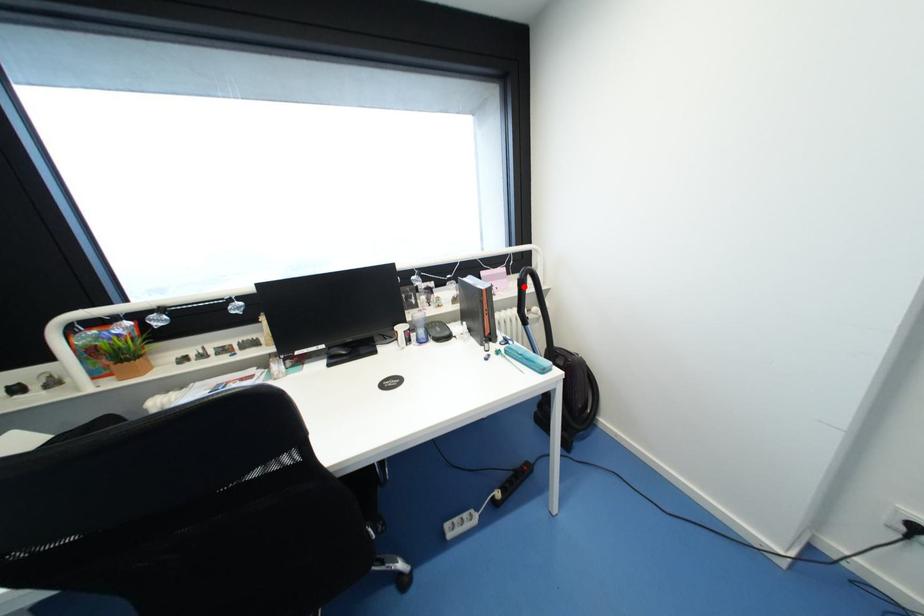
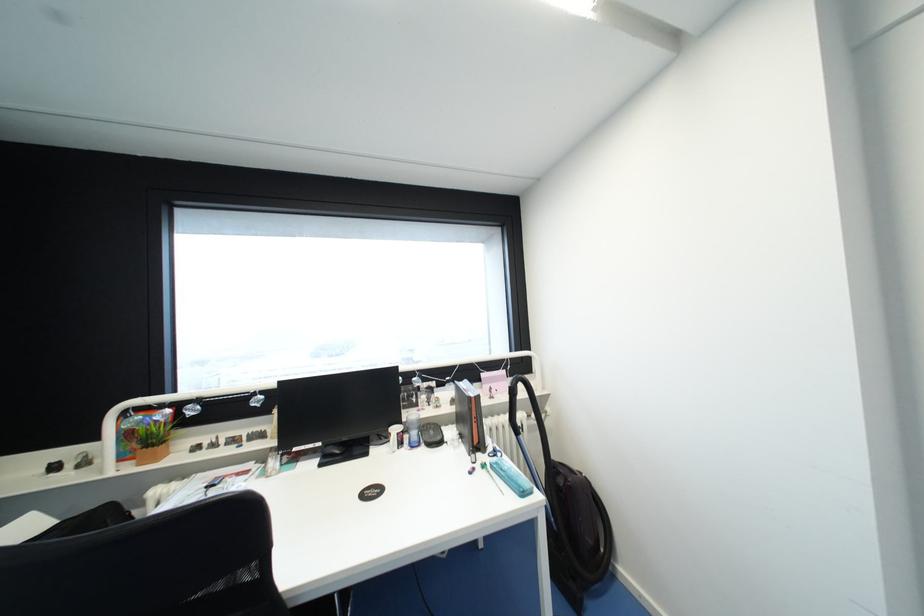
Where in the second image is the point corresponding to the highlighted location from the first image?

(515, 394)